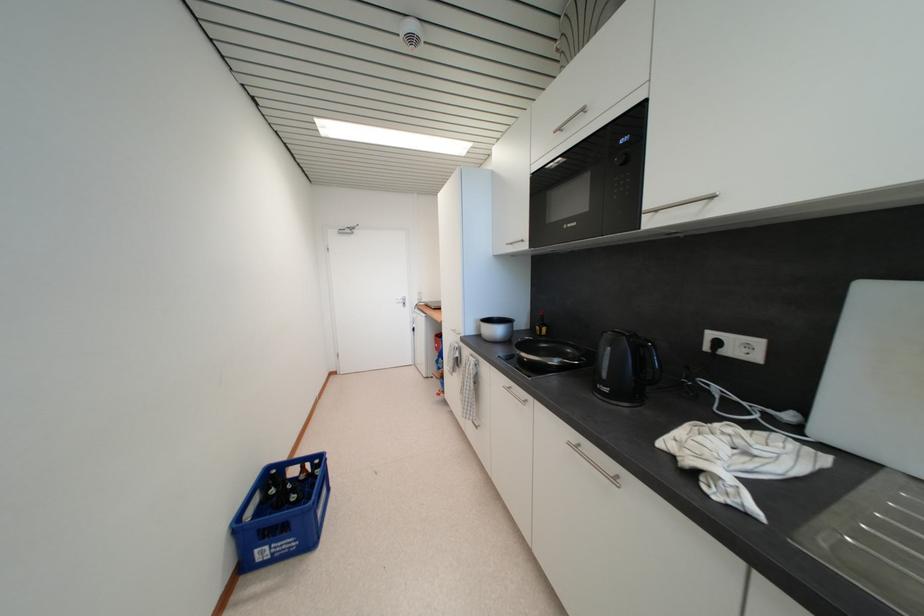
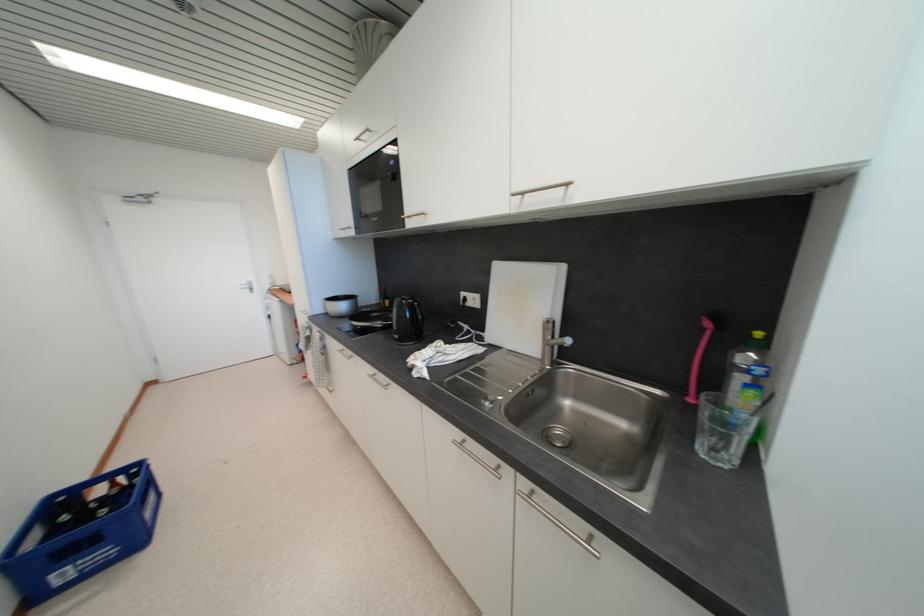
The point at (483, 339) is marked in the first image. Where is the corresponding point in the second image?

(332, 315)